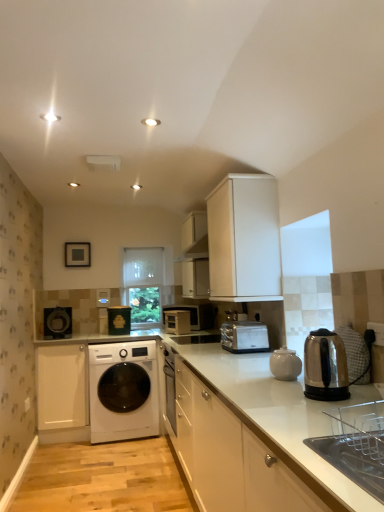
I want to click on vacant space to the right of stainless steel kettle at right, which ranks as the first home appliance in front-to-back order, so click(359, 395).